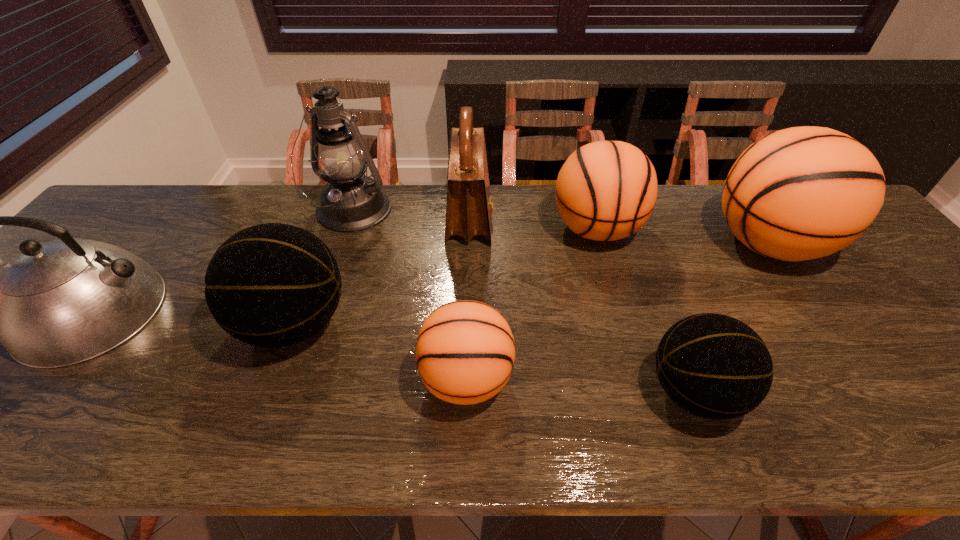
Identify the location of oil lamp. (351, 201).

Where is `shoulder bag`? The width and height of the screenshot is (960, 540). shoulder bag is located at coordinates (469, 209).

Where is `the rightmost orange basketball`? Image resolution: width=960 pixels, height=540 pixels. the rightmost orange basketball is located at coordinates (801, 193).

This screenshot has width=960, height=540. I want to click on the rightmost basketball, so click(x=801, y=193).

What are the coordinates of `the second orange basketball from left to right` in the screenshot? It's located at (606, 190).

Find the location of a particular element. The height and width of the screenshot is (540, 960). the bigger black basketball is located at coordinates (272, 285).

The height and width of the screenshot is (540, 960). What are the coordinates of `the leftmost basketball` in the screenshot? It's located at (272, 285).

What are the coordinates of `the nearest orange basketball` in the screenshot? It's located at (465, 352).

Find the location of `the smallest orange basketball`. the smallest orange basketball is located at coordinates (465, 352).

Find the location of a particular element. the right black basketball is located at coordinates (714, 366).